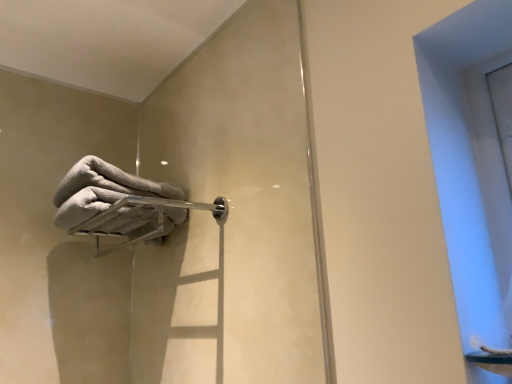
Question: From a real-world perspective, is white fluffy towel at upper left located beneath silver metallic towel bar at upper left?

Choices:
 (A) no
 (B) yes

Answer: (A)

Question: Is white fluffy towel at upper left at the left side of silver metallic towel bar at upper left?

Choices:
 (A) yes
 (B) no

Answer: (A)

Question: Does white fluffy towel at upper left have a greater height compared to silver metallic towel bar at upper left?

Choices:
 (A) yes
 (B) no

Answer: (A)

Question: Are white fluffy towel at upper left and silver metallic towel bar at upper left far apart?

Choices:
 (A) yes
 (B) no

Answer: (B)

Question: From a real-world perspective, is white fluffy towel at upper left positioned over silver metallic towel bar at upper left based on gravity?

Choices:
 (A) no
 (B) yes

Answer: (B)

Question: From the image's perspective, is silver metallic towel bar at upper left positioned above or below transparent glass window at upper right?

Choices:
 (A) below
 (B) above

Answer: (A)

Question: Choose the correct answer: Is silver metallic towel bar at upper left inside transparent glass window at upper right or outside it?

Choices:
 (A) outside
 (B) inside

Answer: (A)

Question: Is silver metallic towel bar at upper left wider or thinner than transparent glass window at upper right?

Choices:
 (A) wide
 (B) thin

Answer: (A)

Question: Considering the positions of silver metallic towel bar at upper left and transparent glass window at upper right in the image, is silver metallic towel bar at upper left bigger or smaller than transparent glass window at upper right?

Choices:
 (A) big
 (B) small

Answer: (A)

Question: From the image's perspective, is white fluffy towel at upper left positioned above or below transparent glass window at upper right?

Choices:
 (A) below
 (B) above

Answer: (B)

Question: In terms of height, does white fluffy towel at upper left look taller or shorter compared to transparent glass window at upper right?

Choices:
 (A) tall
 (B) short

Answer: (B)

Question: Considering the positions of white fluffy towel at upper left and transparent glass window at upper right in the image, is white fluffy towel at upper left wider or thinner than transparent glass window at upper right?

Choices:
 (A) wide
 (B) thin

Answer: (A)

Question: Based on their sizes in the image, would you say white fluffy towel at upper left is bigger or smaller than transparent glass window at upper right?

Choices:
 (A) small
 (B) big

Answer: (A)

Question: Looking at the image, does transparent glass window at upper right seem bigger or smaller compared to silver metallic towel bar at upper left?

Choices:
 (A) big
 (B) small

Answer: (B)

Question: From a real-world perspective, relative to silver metallic towel bar at upper left, is transparent glass window at upper right vertically above or below?

Choices:
 (A) below
 (B) above

Answer: (A)